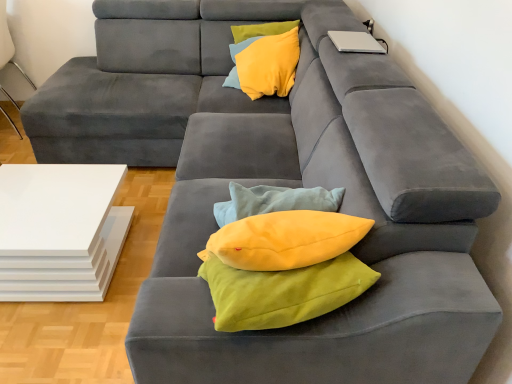
Describe the element at coordinates (8, 44) in the screenshot. Image resolution: width=512 pixels, height=384 pixels. I see `white glossy side table at left` at that location.

At what (x,y) coordinates should I click in order to perform the action: click on silver metallic laptop at upper right. Please return your answer as a coordinate pair (x, y). The image size is (512, 384). Looking at the image, I should click on (356, 42).

This screenshot has height=384, width=512. Identify the location of white glossy side table at left. (8, 44).

Is white glossy table at lower left beside silver metallic laptop at upper right?

white glossy table at lower left and silver metallic laptop at upper right are clearly separated.

How many degrees apart are the facing directions of white glossy table at lower left and silver metallic laptop at upper right?

1.26 degrees.

Is white glossy table at lower left facing towards silver metallic laptop at upper right?

No, white glossy table at lower left is not aimed at silver metallic laptop at upper right.

In terms of height, does white glossy table at lower left look taller or shorter compared to silver metallic laptop at upper right?

Considering their sizes, white glossy table at lower left has more height than silver metallic laptop at upper right.

Is yellow soft cushion at upper center oriented away from white glossy table at lower left?

No, yellow soft cushion at upper center is not facing the opposite direction of white glossy table at lower left.

From a real-world perspective, between yellow soft cushion at upper center and white glossy table at lower left, who is vertically higher?

yellow soft cushion at upper center is physically above.

Measure the distance from yellow soft cushion at upper center to white glossy table at lower left.

The distance of yellow soft cushion at upper center from white glossy table at lower left is 1.18 meters.

Which is behind, point (281, 54) or point (2, 263)?

The point (281, 54) is more distant.

The width and height of the screenshot is (512, 384). What are the coordinates of `laptop to the right of white glossy side table at left` in the screenshot? It's located at (356, 42).

Considering the relative positions of silver metallic laptop at upper right and white glossy side table at left in the image provided, is silver metallic laptop at upper right in front of white glossy side table at left?

Yes, it is.

Consider the image. Is silver metallic laptop at upper right turned away from white glossy side table at left?

No, white glossy side table at left is not at the back of silver metallic laptop at upper right.

In the scene shown: How far apart are silver metallic laptop at upper right and white glossy side table at left?

They are 2.38 meters apart.

Looking at this image, considering the relative sizes of white glossy table at lower left and white glossy side table at left in the image provided, is white glossy table at lower left smaller than white glossy side table at left?

Correct, white glossy table at lower left occupies less space than white glossy side table at left.

Does white glossy table at lower left have a lesser width compared to white glossy side table at left?

No, white glossy table at lower left is not thinner than white glossy side table at left.

From a real-world perspective, is white glossy table at lower left located beneath white glossy side table at left?

Correct, in the physical world, white glossy table at lower left is lower than white glossy side table at left.

Is white glossy side table at left located within white glossy table at lower left?

No, white glossy side table at left is not inside white glossy table at lower left.

Does silver metallic laptop at upper right turn towards yellow soft cushion at upper center?

No, silver metallic laptop at upper right does not turn towards yellow soft cushion at upper center.

Can you confirm if silver metallic laptop at upper right is shorter than yellow soft cushion at upper center?

Indeed, silver metallic laptop at upper right has a lesser height compared to yellow soft cushion at upper center.

Would you say silver metallic laptop at upper right is a long distance from yellow soft cushion at upper center?

They are positioned close to each other.

Is yellow soft cushion at upper center inside the boundaries of white glossy side table at left, or outside?

The correct answer is: outside.

In the scene shown: From a real-world perspective, is yellow soft cushion at upper center above or below white glossy side table at left?

yellow soft cushion at upper center is situated higher than white glossy side table at left in the real world.

Consider the image. From the image's perspective, which one is positioned higher, yellow soft cushion at upper center or white glossy side table at left?

white glossy side table at left, from the image's perspective.

Does yellow soft cushion at upper center touch white glossy side table at left?

No, yellow soft cushion at upper center is not with white glossy side table at left.

This screenshot has width=512, height=384. In order to click on table in front of the yellow soft cushion at upper center in this screenshot , I will do `click(59, 231)`.

Considering the relative positions of white glossy table at lower left and yellow soft cushion at upper center in the image provided, is white glossy table at lower left to the left or to the right of yellow soft cushion at upper center?

Clearly, white glossy table at lower left is on the left of yellow soft cushion at upper center in the image.

Locate an element on the screen. laptop located on the right of white glossy table at lower left is located at coordinates (356, 42).

Find the location of a particular element. This screenshot has height=384, width=512. throw pillow that appears behind the white glossy table at lower left is located at coordinates (269, 64).

Considering their positions, is white glossy table at lower left positioned further to silver metallic laptop at upper right than yellow soft cushion at upper center?

white glossy table at lower left.

Which object lies further to the anchor point white glossy side table at left, silver metallic laptop at upper right or white glossy table at lower left?

Among the two, silver metallic laptop at upper right is located further to white glossy side table at left.

Which object lies nearer to the anchor point silver metallic laptop at upper right, white glossy table at lower left or white glossy side table at left?

white glossy table at lower left is positioned closer to the anchor silver metallic laptop at upper right.

Based on their spatial positions, is silver metallic laptop at upper right or white glossy side table at left closer to white glossy table at lower left?

silver metallic laptop at upper right lies closer to white glossy table at lower left than the other object.

Considering their positions, is yellow soft cushion at upper center positioned closer to white glossy side table at left than white glossy table at lower left?

white glossy table at lower left is positioned closer to the anchor white glossy side table at left.

Looking at this image, based on their spatial positions, is white glossy side table at left or white glossy table at lower left closer to silver metallic laptop at upper right?

white glossy table at lower left.

Which object lies nearer to the anchor point yellow soft cushion at upper center, silver metallic laptop at upper right or white glossy side table at left?

silver metallic laptop at upper right is closer to yellow soft cushion at upper center.

Which object lies nearer to the anchor point white glossy side table at left, white glossy table at lower left or yellow soft cushion at upper center?

Based on the image, white glossy table at lower left appears to be nearer to white glossy side table at left.

Locate an element on the screen. The height and width of the screenshot is (384, 512). table situated between white glossy side table at left and yellow soft cushion at upper center from left to right is located at coordinates (59, 231).

In order to click on throw pillow between white glossy table at lower left and silver metallic laptop at upper right from left to right in this screenshot , I will do `click(269, 64)`.

This screenshot has height=384, width=512. In order to click on throw pillow between white glossy side table at left and silver metallic laptop at upper right in this screenshot , I will do `click(269, 64)`.

Locate an element on the screen. The image size is (512, 384). table between white glossy side table at left and silver metallic laptop at upper right is located at coordinates (59, 231).